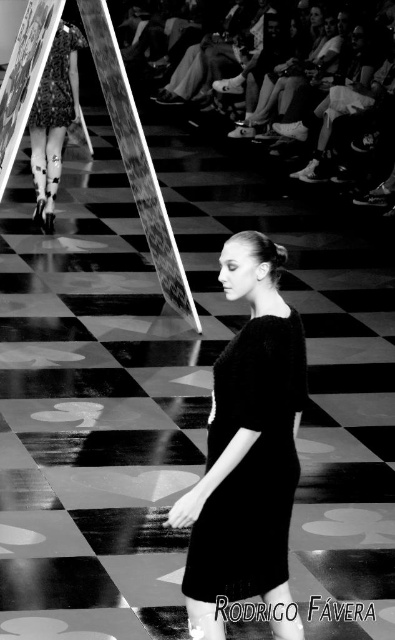
You are a fashion designer observing the runway show. You notice the matte black dress at center and the printed fabric dress at upper left. Which dress appears to be the smaller one in the image?

The matte black dress at center is smaller than the printed fabric dress at upper left, so the matte black dress at center appears to be the smaller one in the image.

You are a photographer standing on the runway. You want to take a picture of the matte black dress at center and the printed fabric dress at left. Are the two dresses close enough to be captured in the same frame without moving the camera?

The matte black dress at center and the printed fabric dress at left are 6.30 meters apart from each other. Since the distance between them is quite large, it might be challenging to capture both in the same frame without adjusting the camera angle or zoom. However, using a wide angle lens could potentially include both dresses in the frame depending on the camera settings.

In the scene shown: You are a photographer at a fashion show. You need to capture a shot where both the matte black dress at center and the printed fabric dress at left are visible. Based on their positions, which dress is closer to the camera?

The printed fabric dress at left is closer to the camera because the matte black dress at center is positioned under it, indicating it is behind.